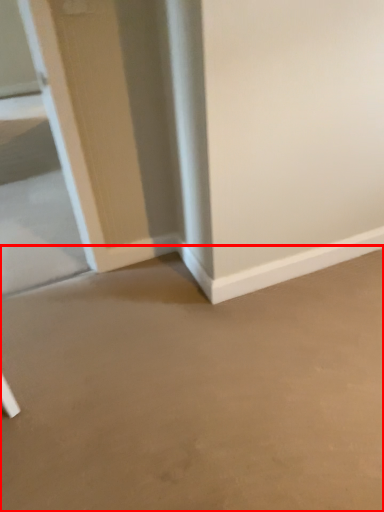
Question: From the image's perspective, what is the correct spatial positioning of concrete (annotated by the red box) in reference to glass door?

Choices:
 (A) below
 (B) above

Answer: (A)